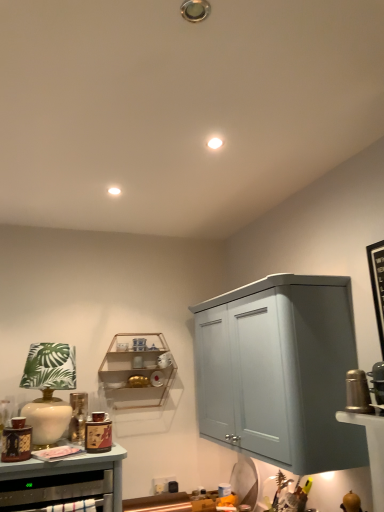
What do you see at coordinates (62, 480) in the screenshot? The image size is (384, 512). I see `matte brown cabinet at lower left` at bounding box center [62, 480].

You are a GUI agent. You are given a task and a screenshot of the screen. Output one action in this format:
    pyautogui.click(x=<x>, y=<y>)
    Task: Click on the white ceramic table lamp at left
    
    Given the screenshot: What is the action you would take?
    pyautogui.click(x=49, y=390)

Is white ceramic table lamp at left facing towards matte brown cabinet at lower left?

No, white ceramic table lamp at left does not turn towards matte brown cabinet at lower left.

Which of these two, white ceramic table lamp at left or matte brown cabinet at lower left, is smaller?

white ceramic table lamp at left is smaller.

Locate an element on the screen. table lamp lying on the left of matte brown cabinet at lower left is located at coordinates (49, 390).

Is white ceramic table lamp at left closer to the viewer compared to matte brown cabinet at lower left?

No, it is behind matte brown cabinet at lower left.

Could you tell me if wooden shelf at center is turned towards matte brown cabinet at lower left?

No, wooden shelf at center is not facing towards matte brown cabinet at lower left.

Relative to matte brown cabinet at lower left, is wooden shelf at center in front or behind?

Visually, wooden shelf at center is located behind matte brown cabinet at lower left.

Identify the location of shelf above the matte brown cabinet at lower left (from the image's perspective). (137, 371).

Considering the relative sizes of wooden shelf at center and matte brown cabinet at lower left in the image provided, is wooden shelf at center taller than matte brown cabinet at lower left?

Yes.

In the image, there is a matte brown cabinet at lower left. Where is `shelf above it (from the image's perspective)`? shelf above it (from the image's perspective) is located at coordinates (137, 371).

From a real-world perspective, which is physically below, matte brown cabinet at lower left or wooden shelf at center?

matte brown cabinet at lower left is physically lower.

How many degrees apart are the facing directions of matte brown cabinet at lower left and wooden shelf at center?

There is a 0.00123-degree angle between the facing directions of matte brown cabinet at lower left and wooden shelf at center.

Looking at this image, choose the correct answer: Is matte brown cabinet at lower left inside wooden shelf at center or outside it?

matte brown cabinet at lower left lies outside wooden shelf at center.

Can you confirm if matte brown cabinet at lower left is positioned to the right of white ceramic table lamp at left?

Indeed, matte brown cabinet at lower left is positioned on the right side of white ceramic table lamp at left.

Are matte brown cabinet at lower left and white ceramic table lamp at left beside each other?

They are not placed beside each other.

Looking at this image, what's the angular difference between matte brown cabinet at lower left and white ceramic table lamp at left's facing directions?

There is a 2.42-degree angle between the facing directions of matte brown cabinet at lower left and white ceramic table lamp at left.

Is wooden shelf at center not within white ceramic table lamp at left?

Yes.

Can you tell me how much wooden shelf at center and white ceramic table lamp at left differ in facing direction?

The angle between the facing direction of wooden shelf at center and the facing direction of white ceramic table lamp at left is 2.42 degrees.

From the image's perspective, relative to white ceramic table lamp at left, is wooden shelf at center above or below?

From the image's perspective, wooden shelf at center appears above white ceramic table lamp at left.

The image size is (384, 512). What are the coordinates of `shelf above the white ceramic table lamp at left (from the image's perspective)` in the screenshot? It's located at click(137, 371).

Consider the image. Is white ceramic table lamp at left facing towards wooden shelf at center?

No.

From a real-world perspective, which is physically above, white ceramic table lamp at left or wooden shelf at center?

wooden shelf at center is physically above.

Which object is positioned more to the right, white ceramic table lamp at left or wooden shelf at center?

wooden shelf at center.

Locate an element on the screen. Image resolution: width=384 pixels, height=512 pixels. cabinetry that is in front of the white ceramic table lamp at left is located at coordinates (62, 480).

You are a GUI agent. You are given a task and a screenshot of the screen. Output one action in this format:
    pyautogui.click(x=<x>, y=<y>)
    Task: Click on the cabinetry on the left of wooden shelf at center
    
    Given the screenshot: What is the action you would take?
    pyautogui.click(x=62, y=480)

Considering their positions, is wooden shelf at center positioned closer to white ceramic table lamp at left than matte brown cabinet at lower left?

Among the two, matte brown cabinet at lower left is located nearer to white ceramic table lamp at left.

Based on their spatial positions, is wooden shelf at center or white ceramic table lamp at left further from matte brown cabinet at lower left?

wooden shelf at center lies further to matte brown cabinet at lower left than the other object.

From the picture: Considering their positions, is matte brown cabinet at lower left positioned further to white ceramic table lamp at left than wooden shelf at center?

wooden shelf at center lies further to white ceramic table lamp at left than the other object.

Considering their positions, is matte brown cabinet at lower left positioned closer to wooden shelf at center than white ceramic table lamp at left?

The object closer to wooden shelf at center is white ceramic table lamp at left.

Looking at the image, which one is located closer to wooden shelf at center, white ceramic table lamp at left or matte brown cabinet at lower left?

white ceramic table lamp at left lies closer to wooden shelf at center than the other object.

Considering their positions, is white ceramic table lamp at left positioned closer to matte brown cabinet at lower left than wooden shelf at center?

white ceramic table lamp at left is positioned closer to the anchor matte brown cabinet at lower left.

At what (x,y) coordinates should I click in order to perform the action: click on table lamp between matte brown cabinet at lower left and wooden shelf at center along the z-axis. Please return your answer as a coordinate pair (x, y). Looking at the image, I should click on (49, 390).